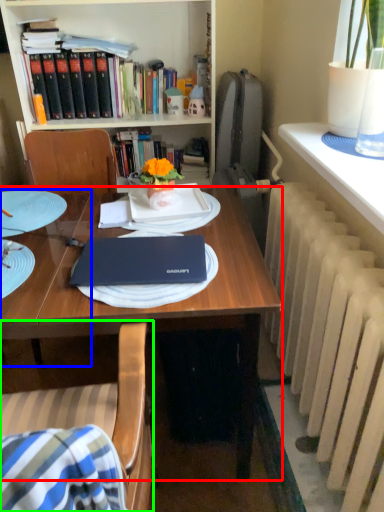
Question: Which object is the farthest from desk (highlighted by a red box)? Choose among these: table (highlighted by a blue box) or chair (highlighted by a green box).

Choices:
 (A) table
 (B) chair

Answer: (A)